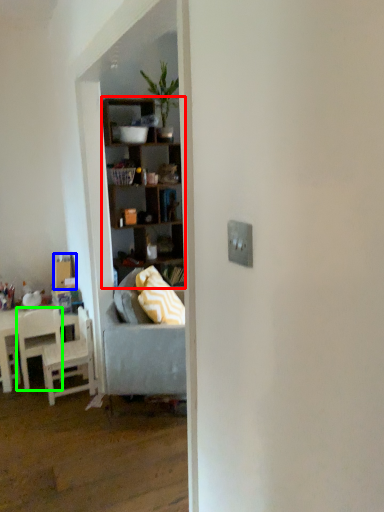
Question: Estimate the real-world distances between objects in this image. Which object is closer to shelf (highlighted by a red box), box (highlighted by a blue box) or chair (highlighted by a green box)?

Choices:
 (A) box
 (B) chair

Answer: (A)